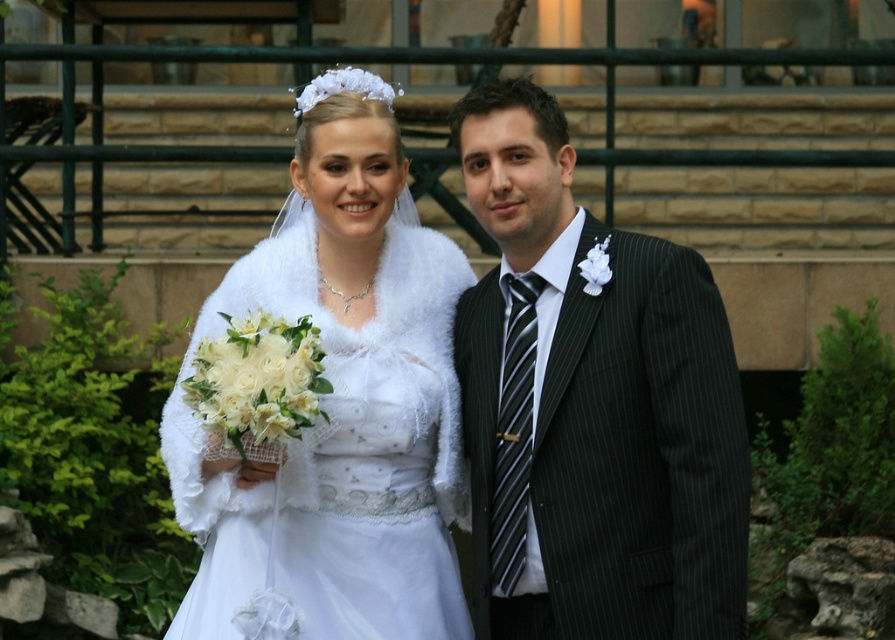
Question: Considering the relative positions of matte black suit at right and white fur shawl at center in the image provided, where is matte black suit at right located with respect to white fur shawl at center?

Choices:
 (A) below
 (B) above

Answer: (B)

Question: Among these points, which one is farthest from the camera?

Choices:
 (A) (371, 449)
 (B) (493, 186)

Answer: (A)

Question: Can you confirm if matte black suit at right is positioned below white fur shawl at center?

Choices:
 (A) yes
 (B) no

Answer: (B)

Question: Observing the image, what is the correct spatial positioning of matte black suit at right in reference to white fur shawl at center?

Choices:
 (A) above
 (B) below

Answer: (A)